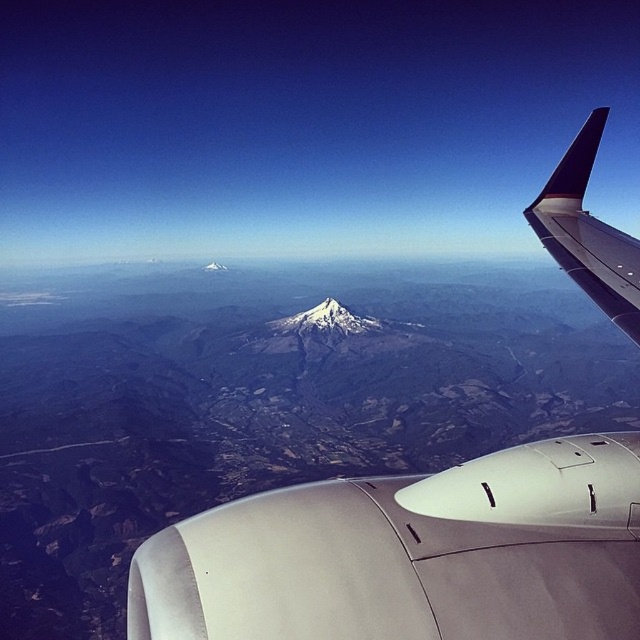
Does point (376, 497) come in front of point (630, 323)?

That is True.

Can you confirm if white matte engine at center is positioned above dark blue matte winglet at upper right?

No, white matte engine at center is not above dark blue matte winglet at upper right.

In order to click on white matte engine at center in this screenshot , I will do `click(412, 554)`.